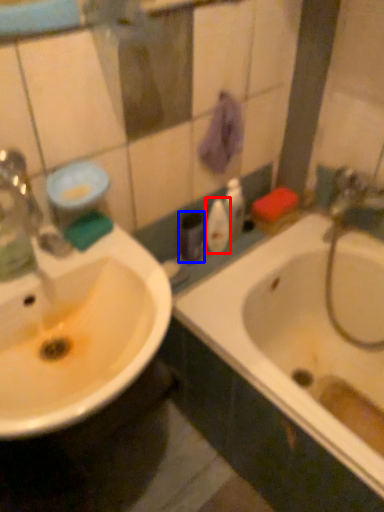
Question: Among these objects, which one is nearest to the camera, mouthwash (highlighted by a red box) or toiletry (highlighted by a blue box)?

Choices:
 (A) mouthwash
 (B) toiletry

Answer: (B)